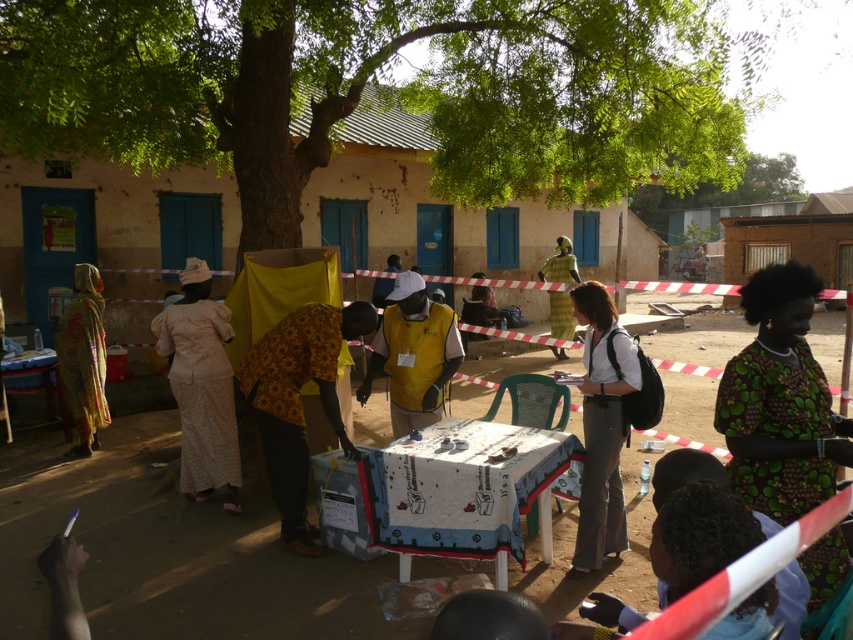
Is green leafy tree at center to the left of white fabric shirt at center from the viewer's perspective?

In fact, green leafy tree at center is to the right of white fabric shirt at center.

Who is higher up, green leafy tree at center or white fabric shirt at center?

green leafy tree at center is higher up.

At what (x,y) coordinates should I click in order to perform the action: click on green leafy tree at center. Please return your answer as a coordinate pair (x, y). The image size is (853, 640). Looking at the image, I should click on (392, 88).

Image resolution: width=853 pixels, height=640 pixels. Find the location of `green leafy tree at center`. green leafy tree at center is located at coordinates (392, 88).

Can you confirm if yellow floral dress at center is positioned below yellow printed fabric at left?

Yes, yellow floral dress at center is below yellow printed fabric at left.

Between yellow floral dress at center and yellow printed fabric at left, which one has less height?

yellow floral dress at center is shorter.

Where is `yellow floral dress at center`? yellow floral dress at center is located at coordinates (297, 401).

Which is above, green leafy tree at center or green printed dress at center?

green leafy tree at center is higher up.

Locate an element on the screen. The height and width of the screenshot is (640, 853). green leafy tree at center is located at coordinates (392, 88).

The width and height of the screenshot is (853, 640). I want to click on green leafy tree at center, so click(392, 88).